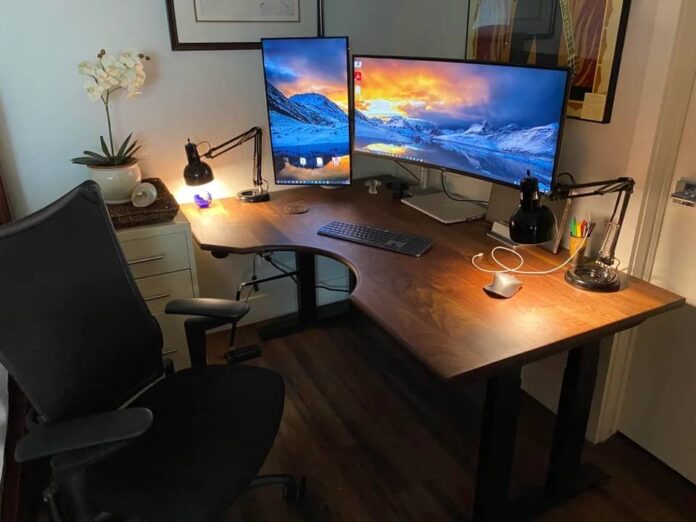
Find the location of `desk`. desk is located at coordinates (433, 333).